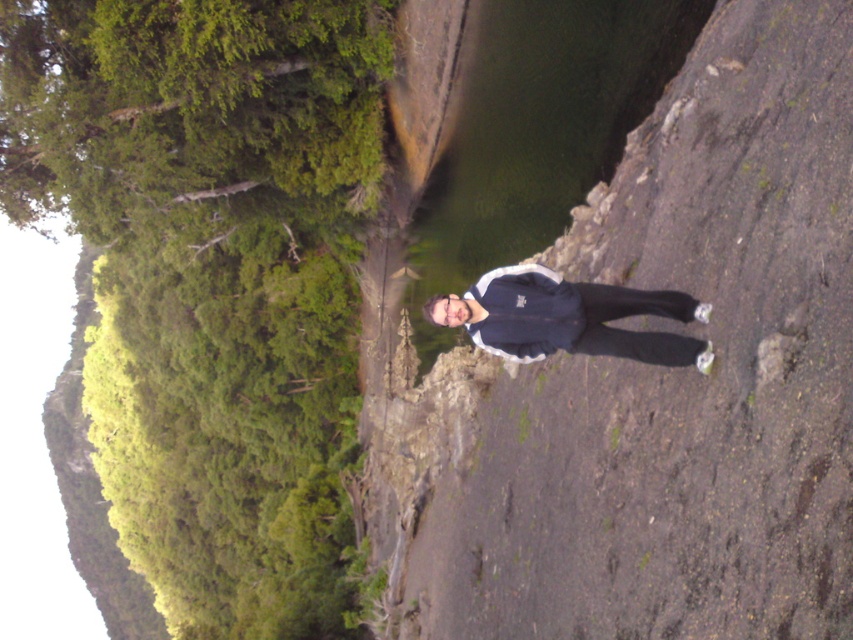
You are a hiker trying to locate your jacket which is the dark blue fabric jacket at center. You notice a dull gray rock at center nearby. Based on the scene, which object is positioned to the right when facing the direction of the image?

The dark blue fabric jacket at center is positioned to the right of the dull gray rock at center.

In the scene shown: You are a hiker who wants to place a GPS marker at the exact center of the image. You have a map showing coordinates where the dull gray rock at center is located at point 0.602, 0.774. What coordinate should you input to mark the center?

The center of the image is at coordinate point (426, 320). Since the dull gray rock at center is at (659, 385), you need to move left and up from the rock to reach the center. Input coordinate (426, 320) for the center.

You are a hiker who wants to step onto the dull gray rock at center to get a better view. However, you notice the dark blue fabric jacket at center nearby. Based on their positions, can you safely step onto the rock without disturbing the jacket?

The dull gray rock at center is closer to the viewer than the dark blue fabric jacket at center, so stepping onto the rock would not disturb the jacket as it is positioned behind the rock.